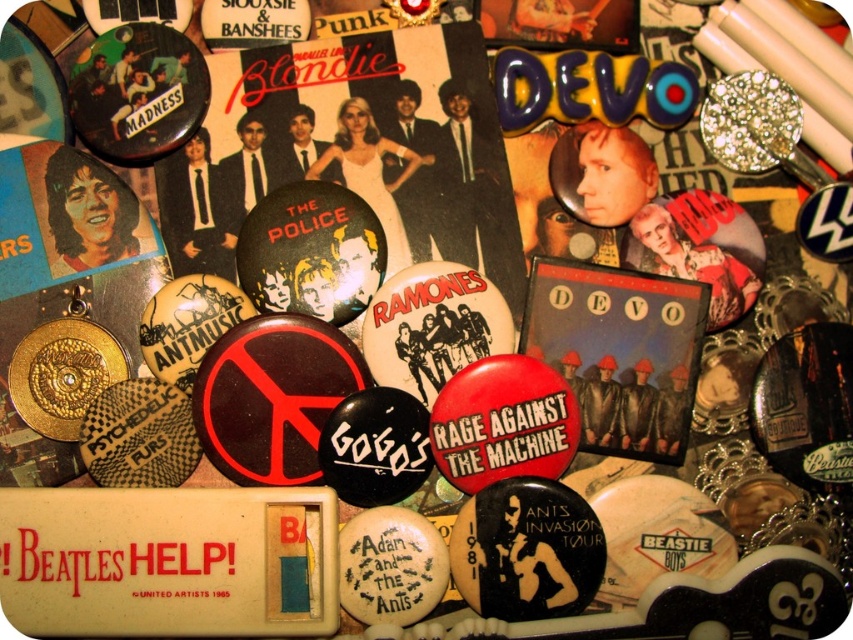
Looking at this image, can you confirm if red matte button at center is positioned to the right of matte black button at upper center?

Yes, red matte button at center is to the right of matte black button at upper center.

In order to click on red matte button at center in this screenshot , I will do `click(619, 352)`.

Which is behind, point (598, 330) or point (276, 3)?

Positioned behind is point (276, 3).

The width and height of the screenshot is (853, 640). What are the coordinates of `red matte button at center` in the screenshot? It's located at (619, 352).

Does point (625, 12) come behind point (252, 38)?

Yes, it is.

Find the location of `matte silver pin at upper center`. matte silver pin at upper center is located at coordinates (560, 22).

Who is more distant from viewer, (532,35) or (213,10)?

The point (532,35) is behind.

Locate an element on the screen. The width and height of the screenshot is (853, 640). matte silver pin at upper center is located at coordinates (560, 22).

Which is more to the left, red matte button at center or matte silver pin at upper center?

matte silver pin at upper center is more to the left.

Who is more forward, (674, 452) or (520, 13)?

Point (674, 452) is in front.

Which is behind, point (592, 282) or point (519, 42)?

Point (519, 42)

Image resolution: width=853 pixels, height=640 pixels. I want to click on red matte button at center, so click(x=619, y=352).